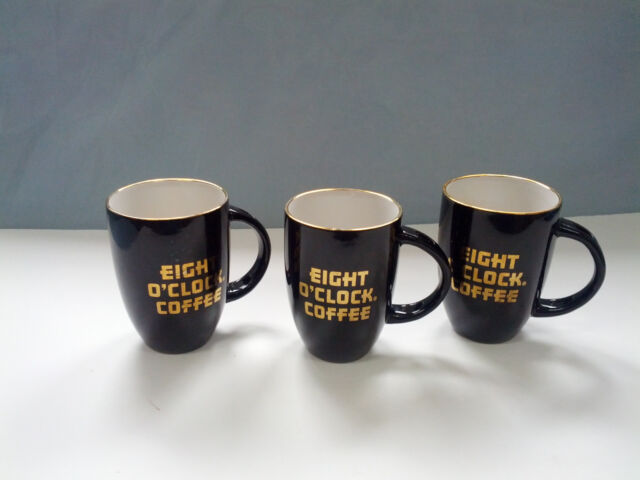
Find the location of a particular element. This screenshot has height=480, width=640. dark grey wall is located at coordinates (378, 92).